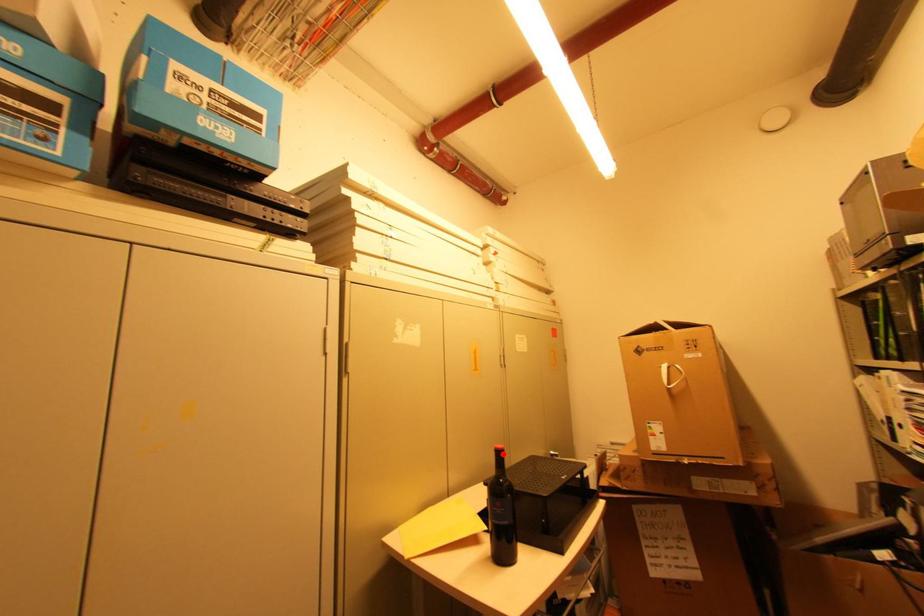
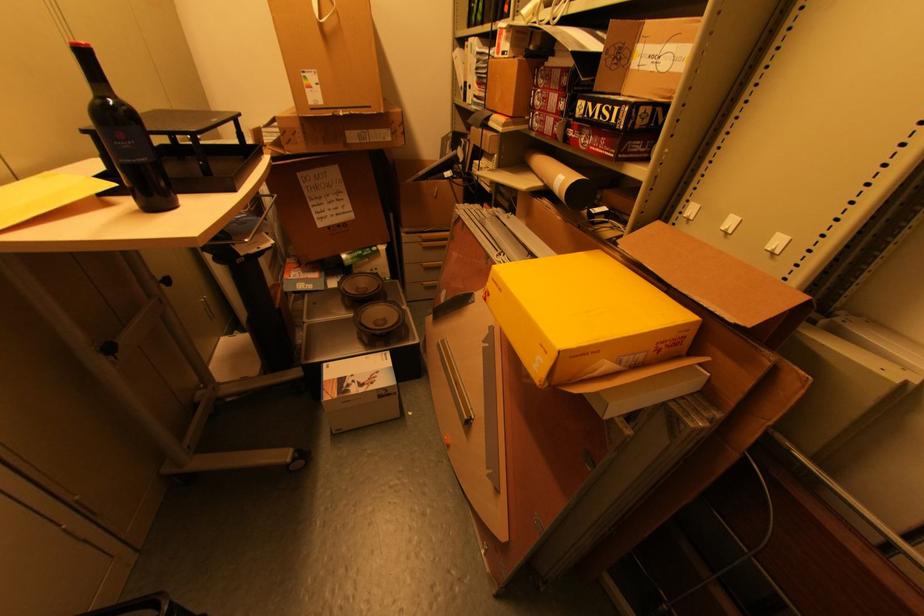
Question: A red point is marked in image1. In image2, is the corresponding 3D point closer to the camera or farther? Reply with the corresponding letter.

Choices:
 (A) The corresponding 3D point is closer.
 (B) The corresponding 3D point is farther.

Answer: (B)